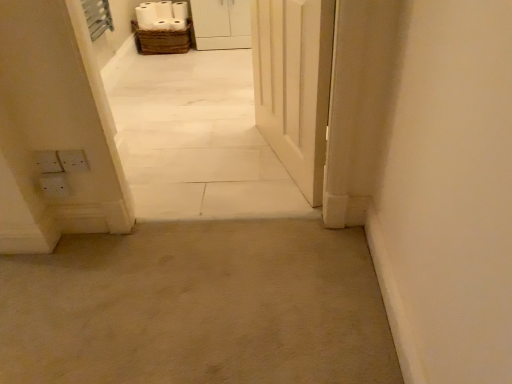
Where is `vacant area that lies in front of white matte door at center`? vacant area that lies in front of white matte door at center is located at coordinates (263, 252).